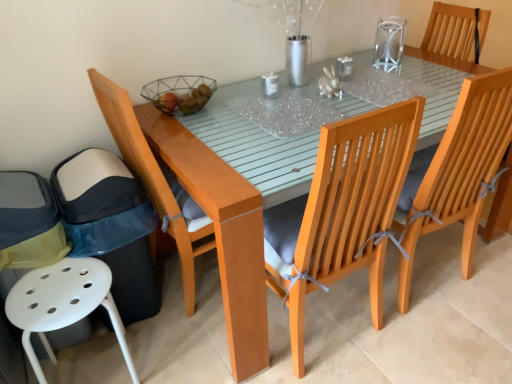
Find the location of `vacant space in front of wire mesh basket at center`. vacant space in front of wire mesh basket at center is located at coordinates (189, 131).